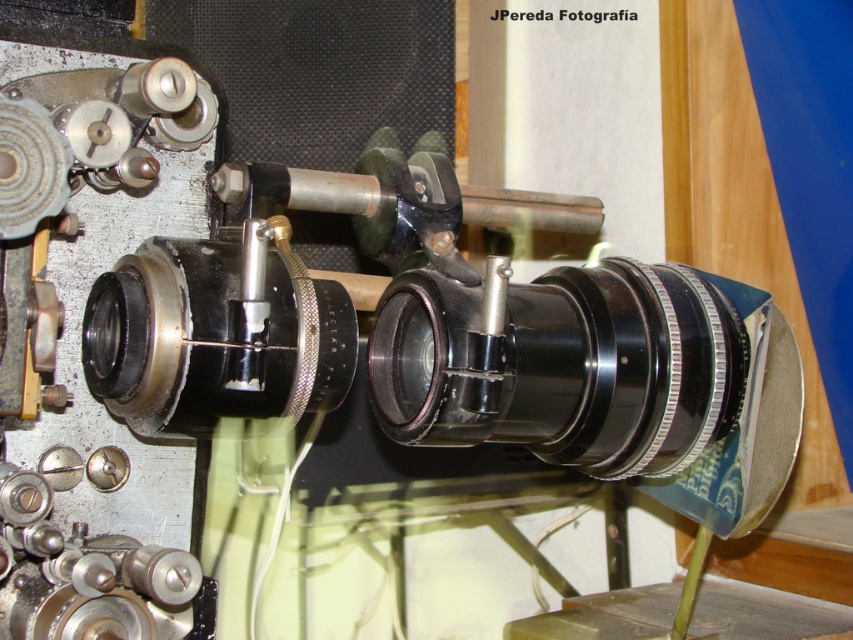
Does black metallic lens at center have a greater height compared to matte black lens at center?

Yes.

Based on the photo, is black metallic lens at center closer to camera compared to matte black lens at center?

No.

Does point (444, 292) come in front of point (131, 397)?

No, it is behind (131, 397).

Identify the location of black metallic lens at center. The image size is (853, 640). (564, 365).